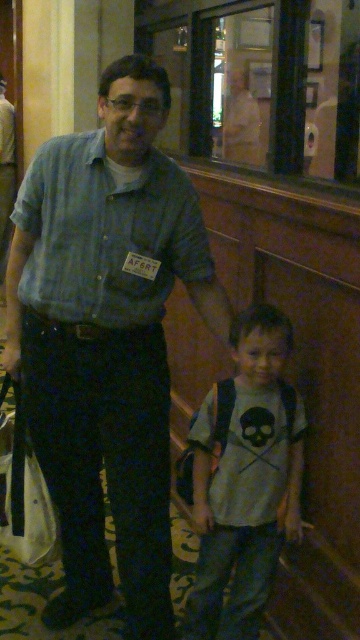
Consider the image. Is blue denim shirt at center thinner than gray cotton t-shirt at center?

No, blue denim shirt at center is not thinner than gray cotton t-shirt at center.

Does blue denim shirt at center appear on the right side of gray cotton t-shirt at center?

No, blue denim shirt at center is not to the right of gray cotton t-shirt at center.

The image size is (360, 640). Find the location of `blue denim shirt at center`. blue denim shirt at center is located at coordinates (106, 236).

At what (x,y) coordinates should I click in order to perform the action: click on blue striped shirt at center. Please return your answer as a coordinate pair (x, y). Image resolution: width=360 pixels, height=640 pixels. Looking at the image, I should click on (106, 337).

Is point (51, 326) farther from camera compared to point (165, 260)?

Yes, point (51, 326) is behind point (165, 260).

This screenshot has width=360, height=640. Identify the location of blue striped shirt at center. (106, 337).

Is blue striped shirt at center thinner than gray cotton t-shirt at center?

In fact, blue striped shirt at center might be wider than gray cotton t-shirt at center.

Is blue striped shirt at center further to camera compared to gray cotton t-shirt at center?

No, blue striped shirt at center is closer to the viewer.

Locate an element on the screen. This screenshot has width=360, height=640. blue striped shirt at center is located at coordinates (106, 337).